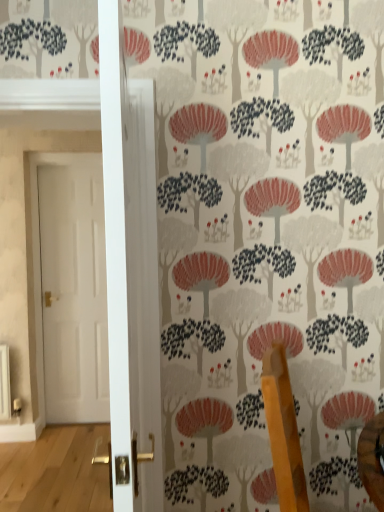
Describe the element at coordinates (73, 287) in the screenshot. This screenshot has height=512, width=384. I see `white glossy door at left` at that location.

Where is `white glossy door at left`? white glossy door at left is located at coordinates tap(73, 287).

Locate an element on the screen. The width and height of the screenshot is (384, 512). white glossy door at left is located at coordinates (73, 287).